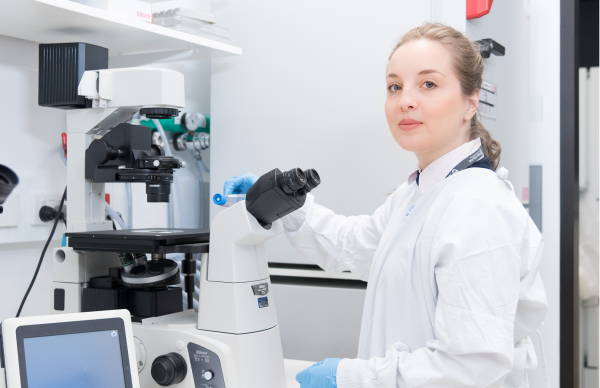
Where is `door frame`? The width and height of the screenshot is (600, 388). door frame is located at coordinates (569, 93).